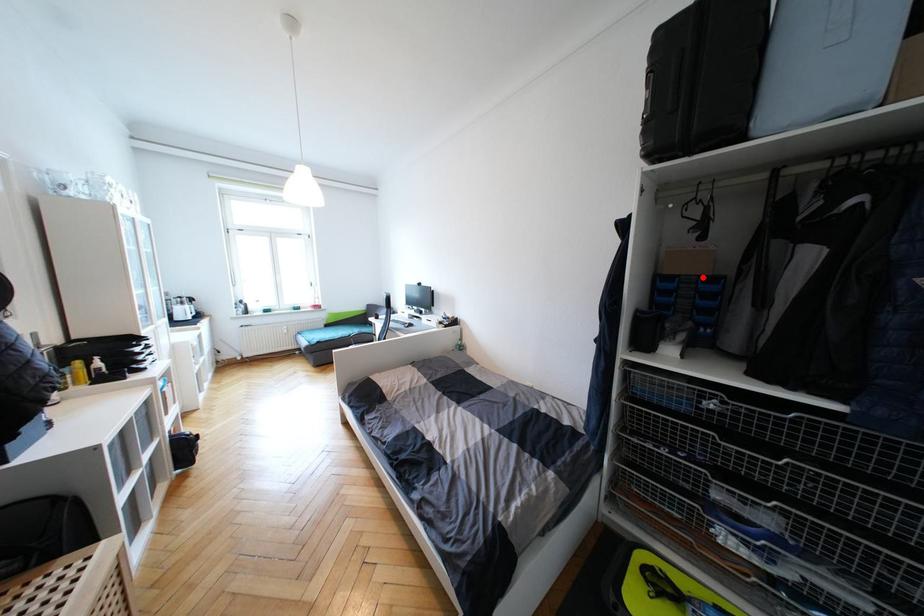
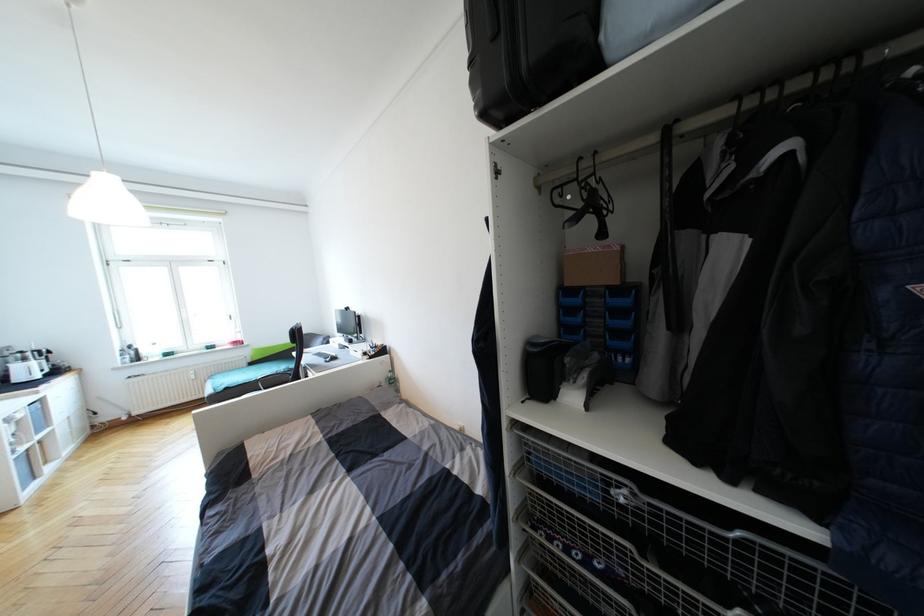
Find the pixel in the second image that matches the highlighted location in the first image.

(611, 288)